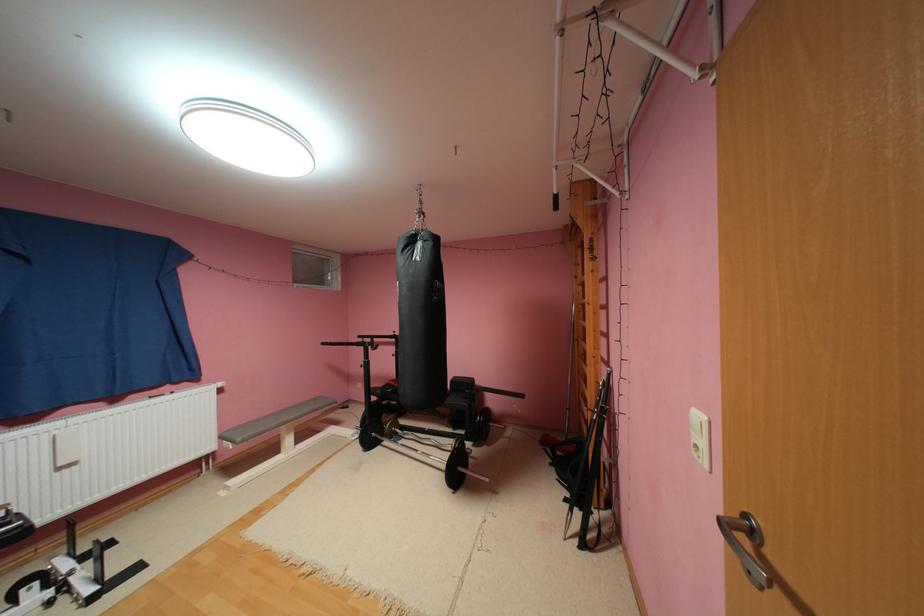
Find the location of a particular element. This screenshot has width=924, height=616. wooden ladder rung is located at coordinates (589, 469).